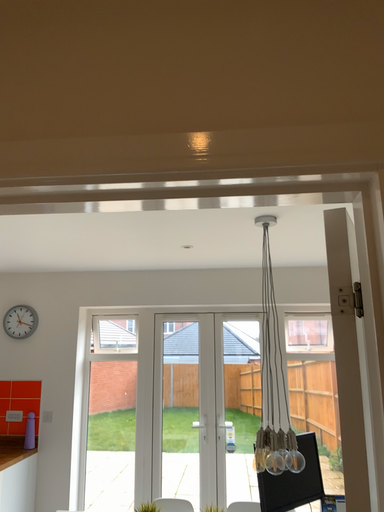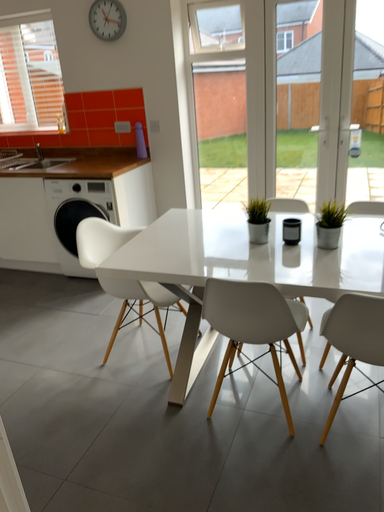
Question: Which way did the camera rotate in the video?

Choices:
 (A) rotated left
 (B) rotated right

Answer: (A)